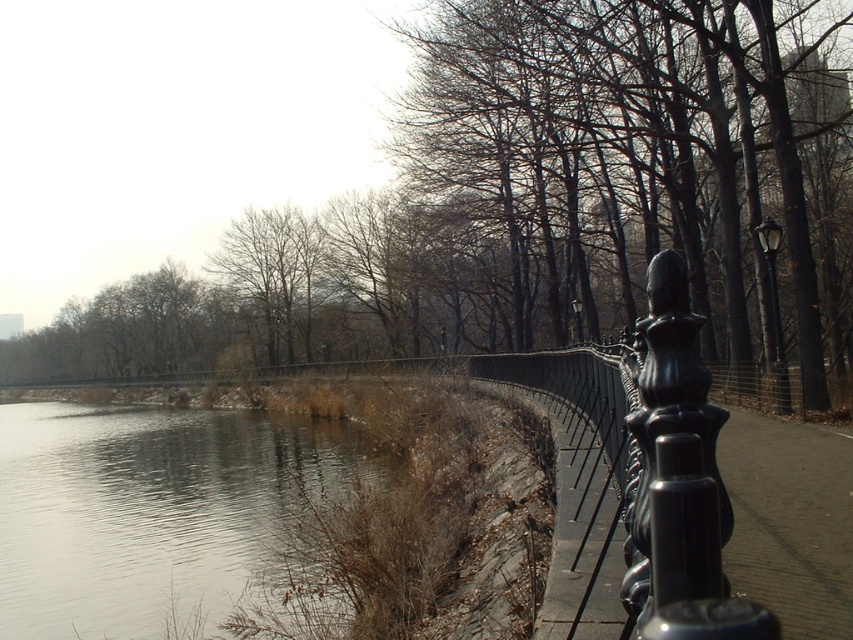
You are standing on the paved pathway and want to walk towards the gray smooth water at lower left. Which direction should you walk relative to the brown leafless tree at center?

The brown leafless tree at center is positioned on the left side of the gray smooth water at lower left, so you should walk towards the right side of the brown leafless tree at center to reach the gray smooth water at lower left.

You are standing in the park and see the point marked at coordinates (x=537, y=202). According to the image, what object is this point located on?

The point at coordinates (x=537, y=202) is located on the brown leafless tree at center.